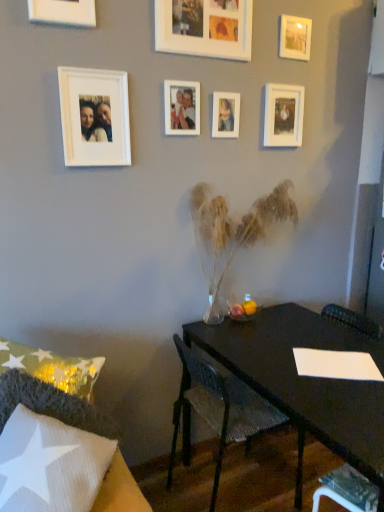
Question: From the image's perspective, is matte white photo frame at center, the 5th picture frame when ordered from left to right, positioned above or below white matte picture frame at upper left, the 2th picture frame from the left?

Choices:
 (A) above
 (B) below

Answer: (A)

Question: Is matte white photo frame at center, the third picture frame positioned from the right, inside the boundaries of white matte picture frame at upper left, the 2th picture frame from the left, or outside?

Choices:
 (A) inside
 (B) outside

Answer: (B)

Question: Considering the real-world distances, which object is farthest from the white matte picture frame at upper center, placed as the 4th picture frame when sorted from left to right?

Choices:
 (A) white matte picture frame at upper right, arranged as the second picture frame when viewed from the right
 (B) white fabric chair at lower left, placed as the second chair when sorted from right to left
 (C) white matte photo frame at center, the 3th picture frame when ordered from left to right
 (D) white matte picture frame at upper left, the sixth picture frame from the right
 (E) metallic silver swivel chair at lower right

Answer: (E)

Question: Which object is positioned farthest from the white matte picture frame at upper right, arranged as the second picture frame when viewed from the right?

Choices:
 (A) white fabric chair at lower left, placed as the second chair when sorted from right to left
 (B) matte white picture frame at upper right, which is counted as the first picture frame, starting from the right
 (C) metallic silver swivel chair at lower right
 (D) white matte picture frame at upper center, placed as the 4th picture frame when sorted from left to right
 (E) white matte picture frame at upper left, the 7th picture frame in the right-to-left sequence

Answer: (A)